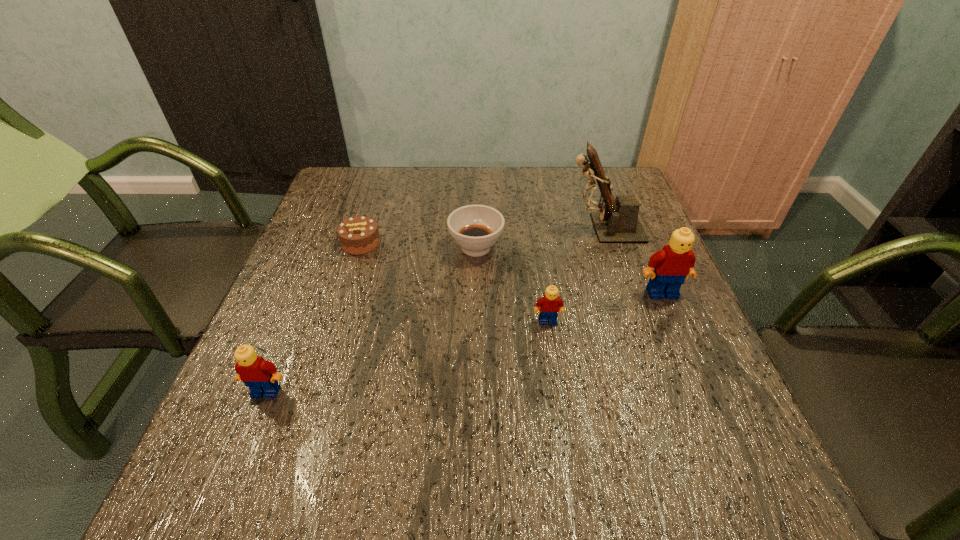
To achieve uniform spacing by inserting another Lego among them, please point to a free space for this new Lego. Please provide its 2D coordinates. Your answer should be formatted as a tuple, i.e. [(x, y)], where the tuple contains the x and y coordinates of a point satisfying the conditions above.

[(417, 354)]